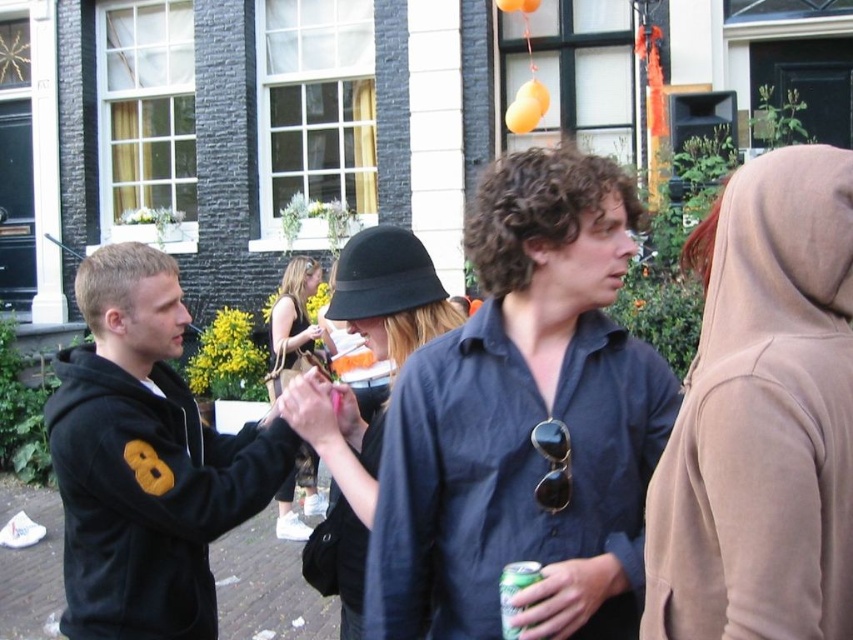
Question: Which object is closer to the camera taking this photo?

Choices:
 (A) green metallic can at center
 (B) black hoodie at left

Answer: (A)

Question: Is beige fleece hoodie at right thinner than black leather hat at center?

Choices:
 (A) no
 (B) yes

Answer: (B)

Question: Which object is farther from the camera taking this photo?

Choices:
 (A) dark blue shirt at center
 (B) black hoodie at left
 (C) matte black hat at center
 (D) green metallic can at center

Answer: (B)

Question: Estimate the real-world distances between objects in this image. Which object is farther from the black hoodie at left?

Choices:
 (A) matte black hat at center
 (B) black leather hat at center
 (C) black felt hat at center
 (D) beige fleece hoodie at right

Answer: (B)

Question: Where is black leather hat at center located in relation to green metallic can at center in the image?

Choices:
 (A) above
 (B) below

Answer: (A)

Question: Does beige fleece hoodie at right appear over matte black hat at center?

Choices:
 (A) no
 (B) yes

Answer: (B)